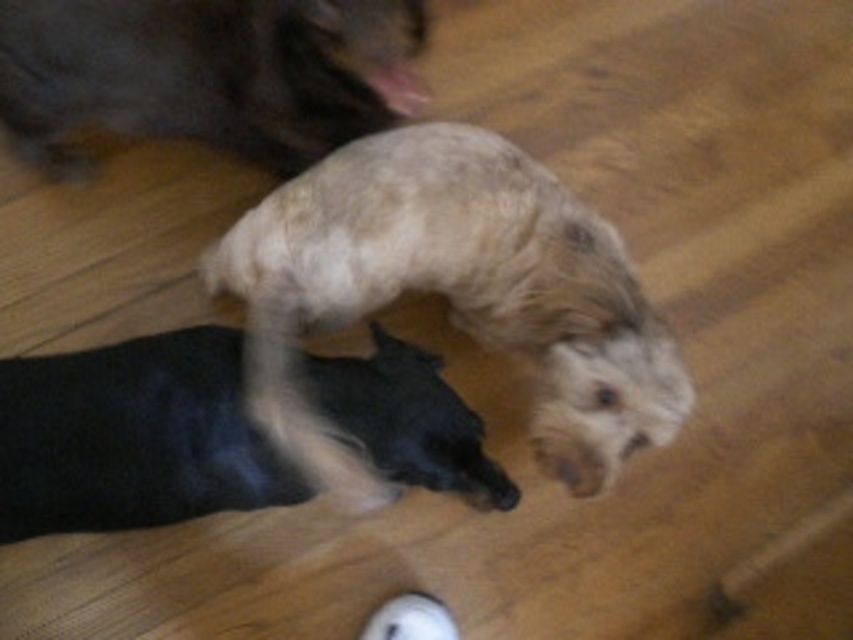
You are standing in the room and want to place a small toy at the point marked as point [369,502]. If your hand is 1.2 meters away from that point, can you reach it without moving your feet?

The distance of point [369,502] from the viewer is 1.33 meters. Since your hand is only 1.2 meters away from the point, you cannot reach it without moving your feet because the point is farther away than your reach.

You are trying to decide which dog to pick up first. The fluffy beige dog at center and the soft brown fur at upper left are both in your view. Based on their sizes, which dog should you pick up first?

The fluffy beige dog at center is larger in width than the soft brown fur at upper left, so you should pick up the smaller soft brown fur at upper left first to avoid stepping on the larger one.

You are standing in the room and want to place a small toy exactly 1.5 meters away from where you are standing. Can you place it at the point labeled point (184, 378)?

The point labeled point (184, 378) is 1.29 meters from the viewer, so placing the toy there would be too close. You need to find another location that is 1.5 meters away.